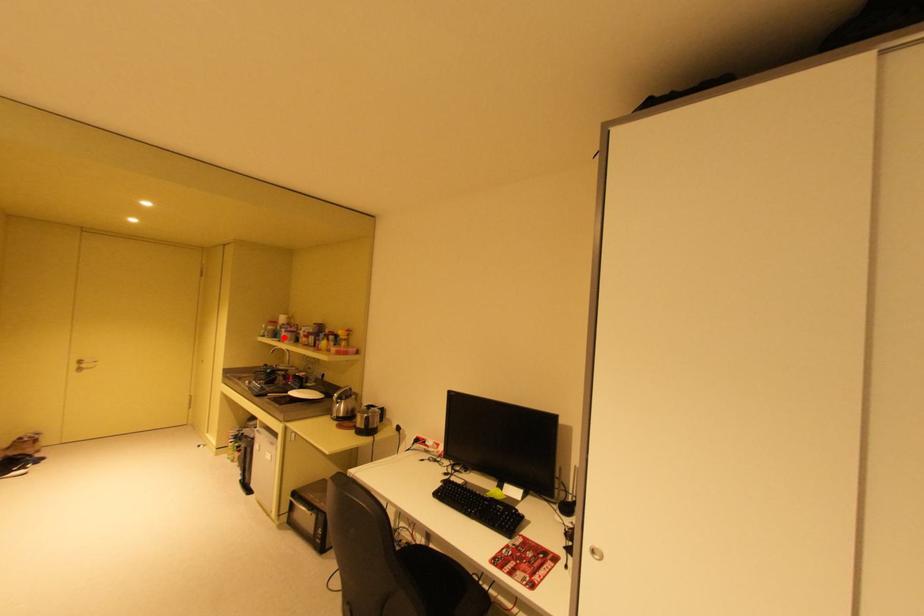
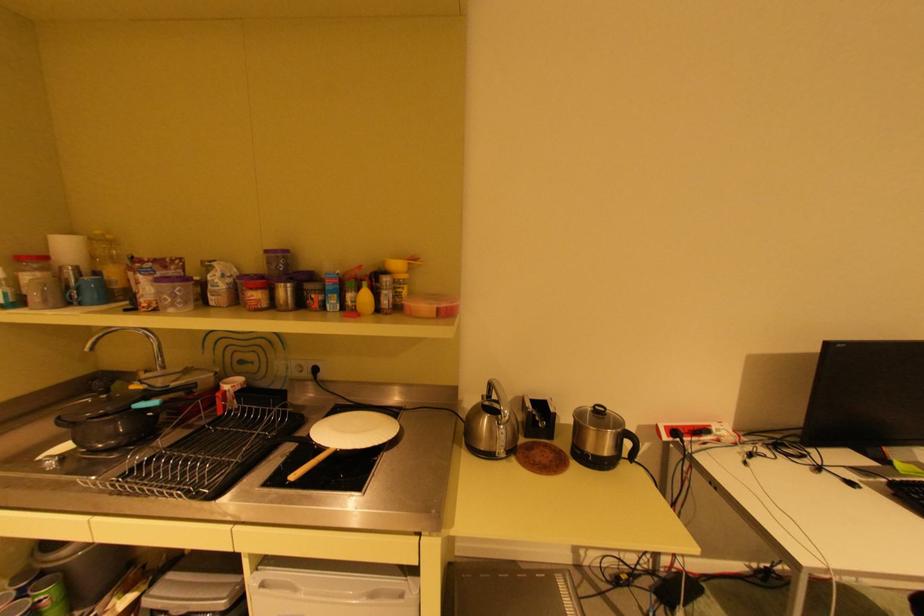
Where in the second image is the point corresponding to the highlighted location from the first image?

(79, 302)